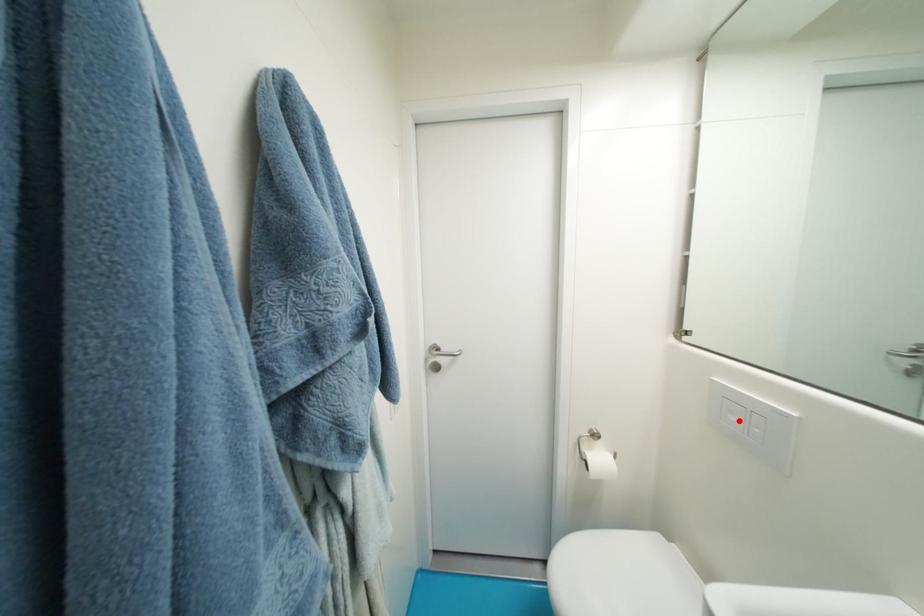
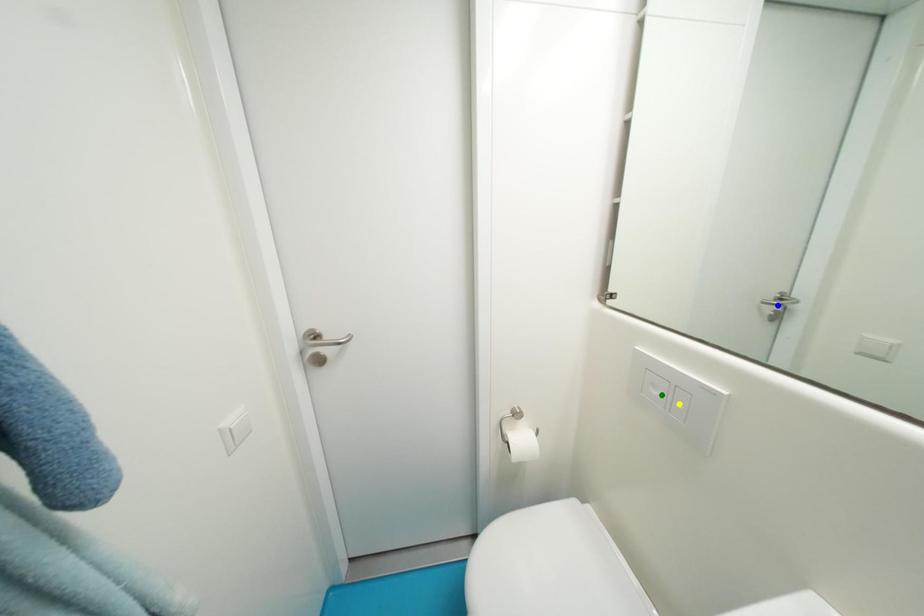
Question: I am providing you with two images of the same scene from different viewpoints. A red point is marked on the first image. You are given multiple points on the second image. In image 2, which mark is for the same physical point as the one in image 1?

Choices:
 (A) yellow point
 (B) blue point
 (C) green point

Answer: (C)